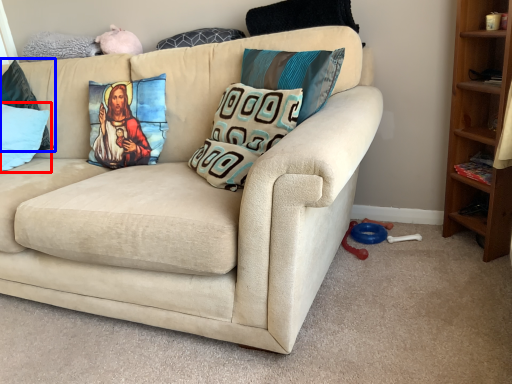
Question: Which of the following is the closest to the observer, pillow (highlighted by a red box) or pillow (highlighted by a blue box)?

Choices:
 (A) pillow
 (B) pillow

Answer: (A)